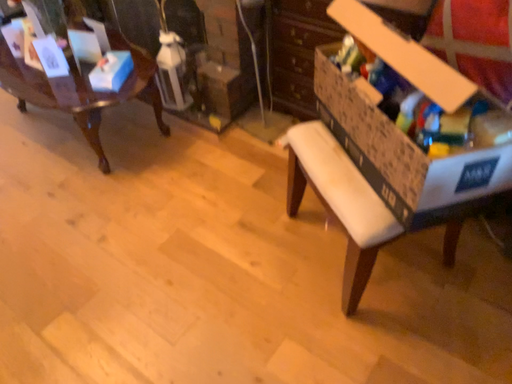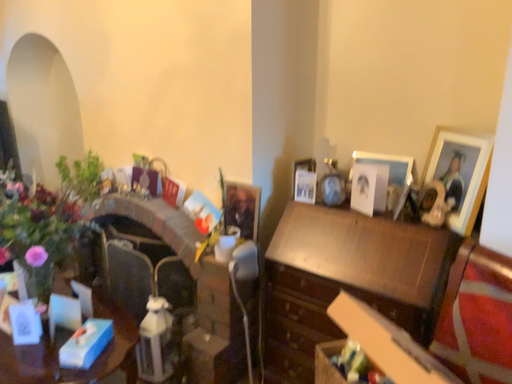
Question: Which way did the camera rotate in the video?

Choices:
 (A) rotated downward
 (B) rotated upward

Answer: (B)